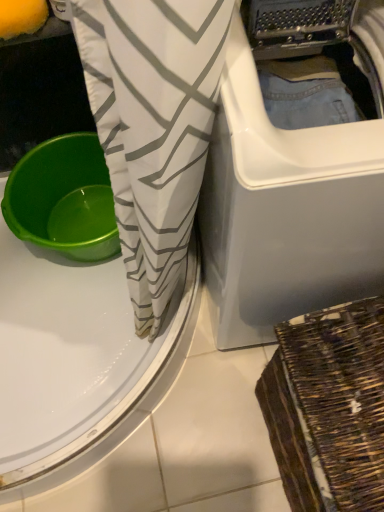
Locate an element on the screen. white fabric with gray zigzag pattern at center is located at coordinates (153, 126).

I want to click on white plastic washing machine at center, so click(x=285, y=211).

Identify the location of green plastic basin at left. The width and height of the screenshot is (384, 512). (63, 198).

At what (x,y) coordinates should I click in order to perform the action: click on woven brown basket at lower right. Please return your answer as a coordinate pair (x, y). Looking at the image, I should click on (343, 395).

Is white plastic washing machine at center oriented away from green plastic basin at left?

No, green plastic basin at left is not at the back of white plastic washing machine at center.

In the scene shown: From the image's perspective, is white plastic washing machine at center positioned above or below green plastic basin at left?

Based on their image positions, white plastic washing machine at center is located above green plastic basin at left.

Where is `basin to the left of white plastic washing machine at center`? The width and height of the screenshot is (384, 512). basin to the left of white plastic washing machine at center is located at coordinates (63, 198).

From a real-world perspective, is white plastic washing machine at center located higher than green plastic basin at left?

Yes, from a real-world perspective, white plastic washing machine at center is above green plastic basin at left.

Can you confirm if white fabric with gray zigzag pattern at center is shorter than woven brown basket at lower right?

No.

Which object is closer to the camera taking this photo, white fabric with gray zigzag pattern at center or woven brown basket at lower right?

woven brown basket at lower right is in front.

Which is more to the left, white fabric with gray zigzag pattern at center or woven brown basket at lower right?

white fabric with gray zigzag pattern at center.

From the image's perspective, relative to woven brown basket at lower right, is white fabric with gray zigzag pattern at center above or below?

Clearly, from the image's perspective, white fabric with gray zigzag pattern at center is above woven brown basket at lower right.

Considering the points (331, 349) and (194, 11), which point is in front, point (331, 349) or point (194, 11)?

Positioned in front is point (194, 11).

Is woven brown basket at lower right shorter than white fabric with gray zigzag pattern at center?

Yes, woven brown basket at lower right is shorter than white fabric with gray zigzag pattern at center.

Considering the relative sizes of woven brown basket at lower right and white fabric with gray zigzag pattern at center in the image provided, is woven brown basket at lower right smaller than white fabric with gray zigzag pattern at center?

Incorrect, woven brown basket at lower right is not smaller in size than white fabric with gray zigzag pattern at center.

From the image's perspective, would you say woven brown basket at lower right is shown under white fabric with gray zigzag pattern at center?

Yes.

Can you tell me how much green plastic basin at left and woven brown basket at lower right differ in facing direction?

90.1 degrees separate the facing orientations of green plastic basin at left and woven brown basket at lower right.

Is green plastic basin at left closer to camera compared to woven brown basket at lower right?

No, it is behind woven brown basket at lower right.

Considering the relative positions of green plastic basin at left and woven brown basket at lower right in the image provided, is green plastic basin at left to the right of woven brown basket at lower right from the viewer's perspective?

In fact, green plastic basin at left is to the left of woven brown basket at lower right.

Considering the relative positions of green plastic basin at left and white fabric with gray zigzag pattern at center in the image provided, is green plastic basin at left to the left of white fabric with gray zigzag pattern at center from the viewer's perspective?

Correct, you'll find green plastic basin at left to the left of white fabric with gray zigzag pattern at center.

Could you tell me if green plastic basin at left is facing white fabric with gray zigzag pattern at center?

No, green plastic basin at left is not oriented towards white fabric with gray zigzag pattern at center.

Consider the image. Which object is further away from the camera taking this photo, green plastic basin at left or white fabric with gray zigzag pattern at center?

green plastic basin at left is further from the camera.

Who is shorter, green plastic basin at left or white fabric with gray zigzag pattern at center?

Standing shorter between the two is green plastic basin at left.

What's the angular difference between woven brown basket at lower right and white plastic washing machine at center's facing directions?

The angle between the facing direction of woven brown basket at lower right and the facing direction of white plastic washing machine at center is 85.8 degrees.

Is woven brown basket at lower right spatially inside white plastic washing machine at center, or outside of it?

woven brown basket at lower right cannot be found inside white plastic washing machine at center.

Can you confirm if woven brown basket at lower right is taller than white plastic washing machine at center?

Incorrect, the height of woven brown basket at lower right is not larger of that of white plastic washing machine at center.

From the image's perspective, is woven brown basket at lower right positioned above or below white plastic washing machine at center?

woven brown basket at lower right is below white plastic washing machine at center.

Is point (120, 157) closer or farther from the camera than point (240, 318)?

Point (120, 157) is closer to the camera than point (240, 318).

Can you tell me how much white fabric with gray zigzag pattern at center and white plastic washing machine at center differ in facing direction?

The angular difference between white fabric with gray zigzag pattern at center and white plastic washing machine at center is 79.7 degrees.

Would you say white fabric with gray zigzag pattern at center contains white plastic washing machine at center?

No.

Can you see white fabric with gray zigzag pattern at center touching white plastic washing machine at center?

white fabric with gray zigzag pattern at center and white plastic washing machine at center are not in contact.

I want to click on basin that is behind the white plastic washing machine at center, so click(x=63, y=198).

Locate an element on the screen. This screenshot has height=512, width=384. basket that is under the white fabric with gray zigzag pattern at center (from a real-world perspective) is located at coordinates (343, 395).

Which object lies nearer to the anchor point white fabric with gray zigzag pattern at center, green plastic basin at left or woven brown basket at lower right?

Based on the image, woven brown basket at lower right appears to be nearer to white fabric with gray zigzag pattern at center.

Estimate the real-world distances between objects in this image. Which object is further from woven brown basket at lower right, green plastic basin at left or white plastic washing machine at center?

Based on the image, green plastic basin at left appears to be further to woven brown basket at lower right.

From the image, which object appears to be farther from woven brown basket at lower right, white fabric with gray zigzag pattern at center or white plastic washing machine at center?

The object further to woven brown basket at lower right is white fabric with gray zigzag pattern at center.

Looking at the image, which one is located further to white plastic washing machine at center, green plastic basin at left or woven brown basket at lower right?

The object further to white plastic washing machine at center is green plastic basin at left.

Considering their positions, is white fabric with gray zigzag pattern at center positioned closer to white plastic washing machine at center than green plastic basin at left?

The object closer to white plastic washing machine at center is white fabric with gray zigzag pattern at center.

Estimate the real-world distances between objects in this image. Which object is closer to white fabric with gray zigzag pattern at center, green plastic basin at left or white plastic washing machine at center?

white plastic washing machine at center lies closer to white fabric with gray zigzag pattern at center than the other object.

From the picture: From the image, which object appears to be farther from green plastic basin at left, white fabric with gray zigzag pattern at center or white plastic washing machine at center?

Among the two, white plastic washing machine at center is located further to green plastic basin at left.

From the image, which object appears to be nearer to white plastic washing machine at center, woven brown basket at lower right or green plastic basin at left?

Among the two, woven brown basket at lower right is located nearer to white plastic washing machine at center.

The width and height of the screenshot is (384, 512). Find the location of `clothing between white plastic washing machine at center and woven brown basket at lower right in the vertical direction`. clothing between white plastic washing machine at center and woven brown basket at lower right in the vertical direction is located at coordinates (153, 126).

This screenshot has height=512, width=384. Find the location of `washing machine between green plastic basin at left and woven brown basket at lower right from left to right`. washing machine between green plastic basin at left and woven brown basket at lower right from left to right is located at coordinates (285, 211).

Identify the location of clothing located between white plastic washing machine at center and green plastic basin at left in the depth direction. (153, 126).

This screenshot has height=512, width=384. Find the location of `clothing located between green plastic basin at left and woven brown basket at lower right in the left-right direction`. clothing located between green plastic basin at left and woven brown basket at lower right in the left-right direction is located at coordinates (153, 126).